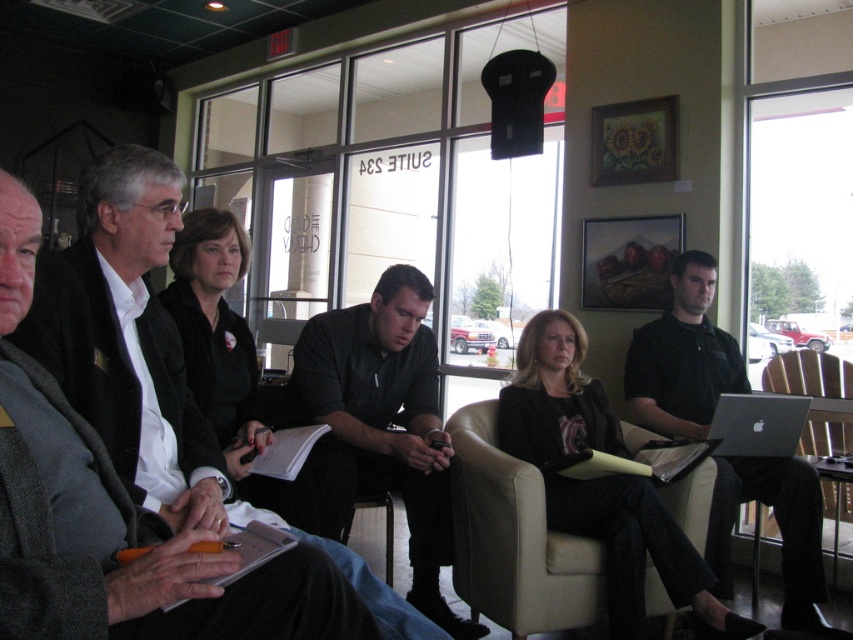
Question: From the image, what is the correct spatial relationship of dark gray shirt at center in relation to beige leather armchair at center?

Choices:
 (A) above
 (B) below

Answer: (A)

Question: In this image, where is beige leather armchair at center located relative to brown leather armchair at center?

Choices:
 (A) above
 (B) below

Answer: (B)

Question: Which point is closer to the camera?

Choices:
 (A) leather armchair at center
 (B) dark gray shirt at center

Answer: (B)

Question: Does dark gray shirt at center come behind black shirt at center?

Choices:
 (A) no
 (B) yes

Answer: (A)

Question: Which point is closer to the camera?

Choices:
 (A) pos(367,456)
 (B) pos(718,346)
 (C) pos(776,445)
 (D) pos(347,522)

Answer: (A)

Question: Considering the real-world distances, which object is farthest from the matte black jacket at center?

Choices:
 (A) black shirt at center
 (B) silver metallic laptop at right
 (C) brown leather armchair at center
 (D) leather armchair at center

Answer: (C)